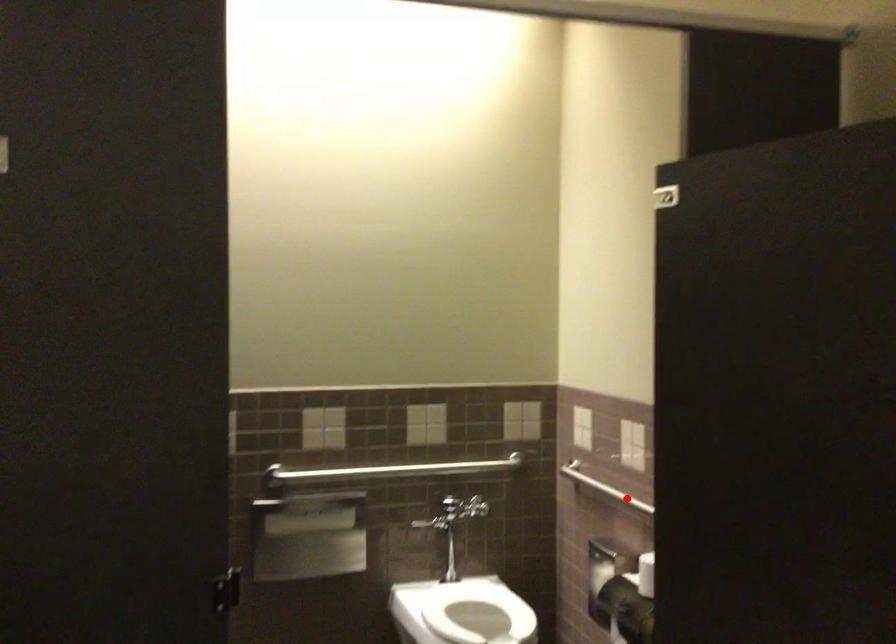
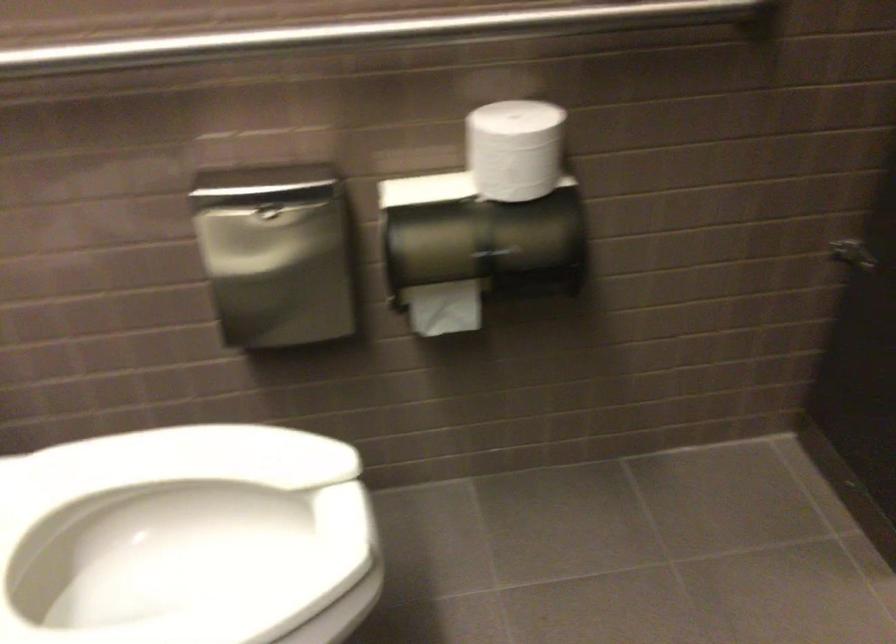
Question: I am providing you with two images of the same scene from different viewpoints. Given a red point in image1, look at the same physical point in image2. Is it:

Choices:
 (A) Closer to the viewpoint
 (B) Farther from the viewpoint

Answer: (A)